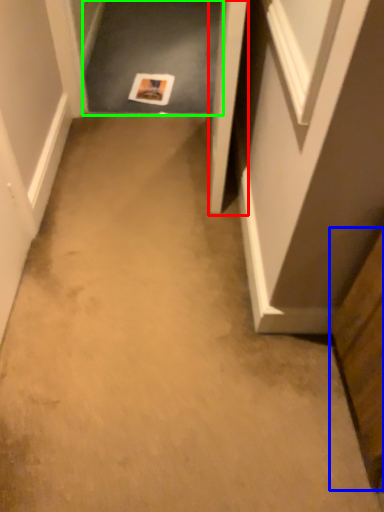
Question: Which object is the farthest from door (highlighted by a red box)? Choose among these: cabinetry (highlighted by a blue box) or passage (highlighted by a green box).

Choices:
 (A) cabinetry
 (B) passage

Answer: (B)